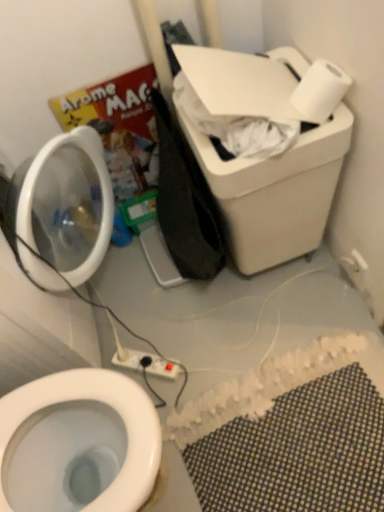
Question: From the image's perspective, is white matte toilet paper at upper right on white mesh bath mat at lower right?

Choices:
 (A) yes
 (B) no

Answer: (A)

Question: Does white matte toilet paper at upper right contain white mesh bath mat at lower right?

Choices:
 (A) no
 (B) yes

Answer: (A)

Question: Can you confirm if white matte toilet paper at upper right is thinner than white mesh bath mat at lower right?

Choices:
 (A) no
 (B) yes

Answer: (B)

Question: Is white matte toilet paper at upper right facing towards white mesh bath mat at lower right?

Choices:
 (A) no
 (B) yes

Answer: (A)

Question: Is white matte toilet paper at upper right smaller than white mesh bath mat at lower right?

Choices:
 (A) no
 (B) yes

Answer: (B)

Question: Is white matte toilet paper at upper right not inside white mesh bath mat at lower right?

Choices:
 (A) no
 (B) yes

Answer: (B)

Question: Is the depth of white matte toilet paper at upper right greater than that of white plastic power strip at lower center, arranged as the first electric outlet when viewed from the left?

Choices:
 (A) no
 (B) yes

Answer: (A)

Question: Can you confirm if white matte toilet paper at upper right is bigger than white plastic power strip at lower center, the 2th electric outlet when ordered from right to left?

Choices:
 (A) yes
 (B) no

Answer: (A)

Question: From the image's perspective, is white matte toilet paper at upper right above white plastic power strip at lower center, the 2th electric outlet when ordered from right to left?

Choices:
 (A) yes
 (B) no

Answer: (A)

Question: Considering the relative sizes of white matte toilet paper at upper right and white plastic power strip at lower center, acting as the 2th electric outlet starting from the top, in the image provided, is white matte toilet paper at upper right wider than white plastic power strip at lower center, acting as the 2th electric outlet starting from the top,?

Choices:
 (A) no
 (B) yes

Answer: (A)

Question: Can you confirm if white matte toilet paper at upper right is thinner than white plastic power strip at lower center, acting as the 2th electric outlet starting from the top?

Choices:
 (A) yes
 (B) no

Answer: (A)

Question: Does white matte toilet paper at upper right appear on the right side of white plastic power strip at lower center, arranged as the first electric outlet when viewed from the left?

Choices:
 (A) no
 (B) yes

Answer: (B)

Question: From a real-world perspective, is white plastic electric outlet at upper right, marked as the 2th electric outlet in a bottom-to-top arrangement, over white plastic power strip at lower center, arranged as the first electric outlet when viewed from the left?

Choices:
 (A) no
 (B) yes

Answer: (B)